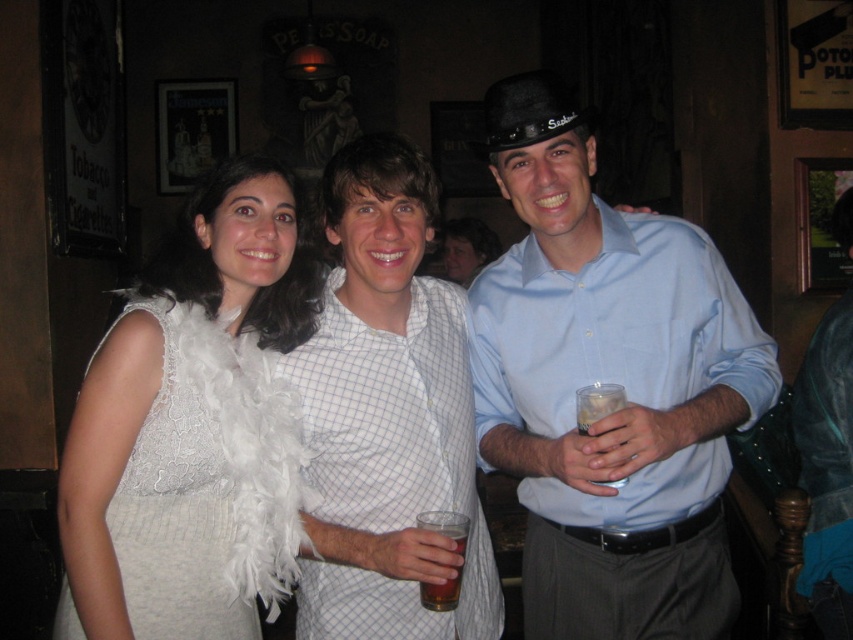
Which is in front, point (119, 486) or point (422, 580)?

Point (422, 580) is more forward.

Who is positioned more to the right, white feather boa at left or white checkered shirt at center?

Positioned to the right is white checkered shirt at center.

Is point (183, 268) farther from viewer compared to point (387, 262)?

That is False.

You are a GUI agent. You are given a task and a screenshot of the screen. Output one action in this format:
    pyautogui.click(x=<x>, y=<y>)
    Task: Click on the white feather boa at left
    The image size is (853, 640).
    Given the screenshot: What is the action you would take?
    pyautogui.click(x=189, y=428)

Is light blue shirt at center to the left of brown translucent glass at center from the viewer's perspective?

No, light blue shirt at center is not to the left of brown translucent glass at center.

Does light blue shirt at center appear over brown translucent glass at center?

Indeed, light blue shirt at center is positioned over brown translucent glass at center.

The height and width of the screenshot is (640, 853). In order to click on light blue shirt at center in this screenshot , I will do `click(611, 381)`.

You are a GUI agent. You are given a task and a screenshot of the screen. Output one action in this format:
    pyautogui.click(x=<x>, y=<y>)
    Task: Click on the white checkered shirt at center
    Image resolution: width=853 pixels, height=640 pixels.
    Given the screenshot: What is the action you would take?
    pyautogui.click(x=387, y=413)

Is white checkered shirt at center above brown translucent glass at center?

Yes, white checkered shirt at center is above brown translucent glass at center.

Between point (434, 301) and point (468, 531), which one is positioned in front?

Point (468, 531) is in front.

Image resolution: width=853 pixels, height=640 pixels. What are the coordinates of `white checkered shirt at center` in the screenshot? It's located at (387, 413).